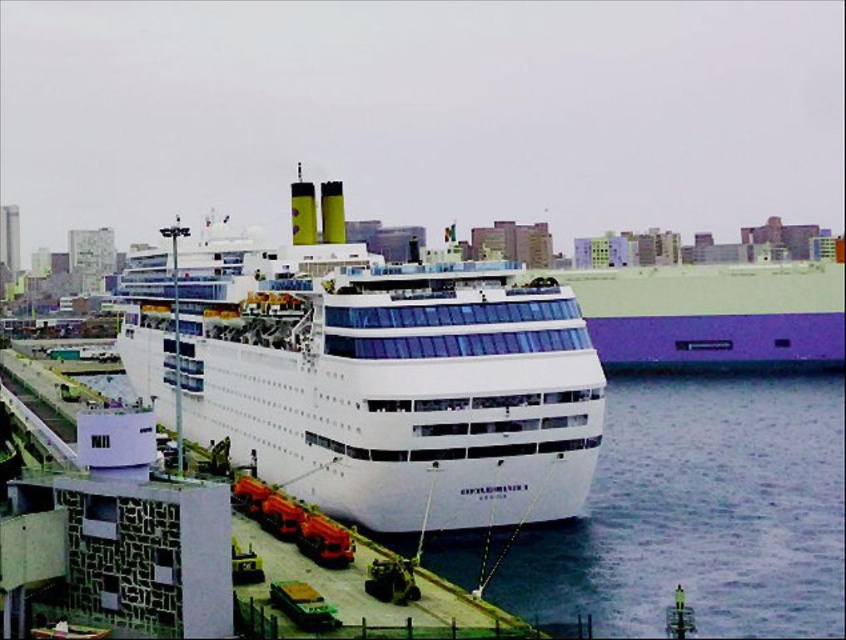
Is point (298, 225) more distant than point (687, 561)?

Yes, point (298, 225) is behind point (687, 561).

Does white glossy cruise ship at center appear under clear water at lower center?

Actually, white glossy cruise ship at center is above clear water at lower center.

Is point (294, 272) behind point (599, 500)?

Yes, it is.

At what (x,y) coordinates should I click in order to perform the action: click on white glossy cruise ship at center. Please return your answer as a coordinate pair (x, y). The width and height of the screenshot is (846, 640). Looking at the image, I should click on (389, 378).